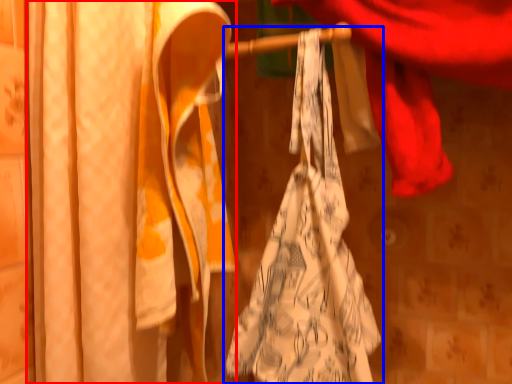
Question: Among these objects, which one is nearest to the camera, curtain (highlighted by a red box) or towel (highlighted by a blue box)?

Choices:
 (A) curtain
 (B) towel

Answer: (A)